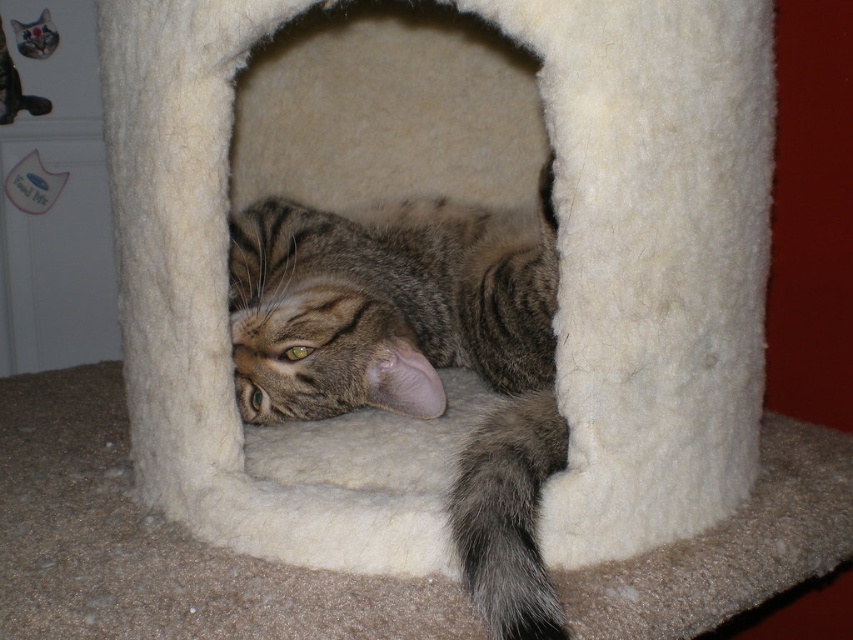
Is white felt cat bed at center to the right of tabby fur cat at center from the viewer's perspective?

Indeed, white felt cat bed at center is positioned on the right side of tabby fur cat at center.

Who is more distant from viewer, (657, 177) or (564, 420)?

The point (564, 420) is behind.

This screenshot has height=640, width=853. Describe the element at coordinates (653, 259) in the screenshot. I see `white felt cat bed at center` at that location.

Find the location of a particular element. This screenshot has width=853, height=640. white felt cat bed at center is located at coordinates (653, 259).